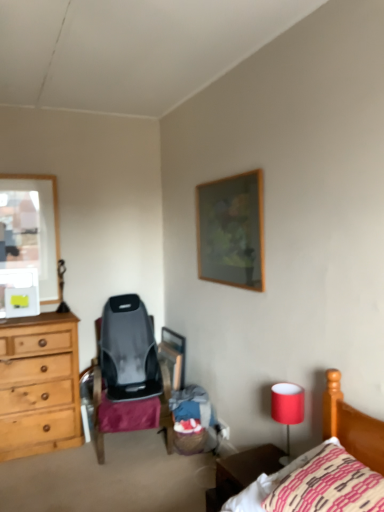
Question: Is wooden picture frame at upper center aimed at red fabric lampshade at lower right?

Choices:
 (A) no
 (B) yes

Answer: (A)

Question: Does wooden picture frame at upper center have a greater width compared to red fabric lampshade at lower right?

Choices:
 (A) yes
 (B) no

Answer: (B)

Question: Is red fabric lampshade at lower right inside wooden picture frame at upper center?

Choices:
 (A) yes
 (B) no

Answer: (B)

Question: Considering the relative positions of wooden picture frame at upper center and red fabric lampshade at lower right in the image provided, is wooden picture frame at upper center to the right of red fabric lampshade at lower right from the viewer's perspective?

Choices:
 (A) yes
 (B) no

Answer: (B)

Question: From a real-world perspective, is wooden picture frame at upper center on top of red fabric lampshade at lower right?

Choices:
 (A) no
 (B) yes

Answer: (B)

Question: From the image's perspective, does wooden picture frame at upper center appear higher than red fabric lampshade at lower right?

Choices:
 (A) yes
 (B) no

Answer: (A)

Question: Is red fabric lampshade at lower right bigger than brown wooden nightstand at lower right?

Choices:
 (A) yes
 (B) no

Answer: (B)

Question: Does red fabric lampshade at lower right have a greater width compared to brown wooden nightstand at lower right?

Choices:
 (A) no
 (B) yes

Answer: (A)

Question: Is red fabric lampshade at lower right to the right of brown wooden nightstand at lower right from the viewer's perspective?

Choices:
 (A) no
 (B) yes

Answer: (B)

Question: Is red fabric lampshade at lower right oriented towards brown wooden nightstand at lower right?

Choices:
 (A) no
 (B) yes

Answer: (A)

Question: Is red fabric lampshade at lower right positioned far away from brown wooden nightstand at lower right?

Choices:
 (A) no
 (B) yes

Answer: (A)

Question: From the image's perspective, is red fabric lampshade at lower right above brown wooden nightstand at lower right?

Choices:
 (A) yes
 (B) no

Answer: (A)

Question: Is knitted cotton pillow at lower right wider than wooden picture frame at upper center?

Choices:
 (A) no
 (B) yes

Answer: (B)